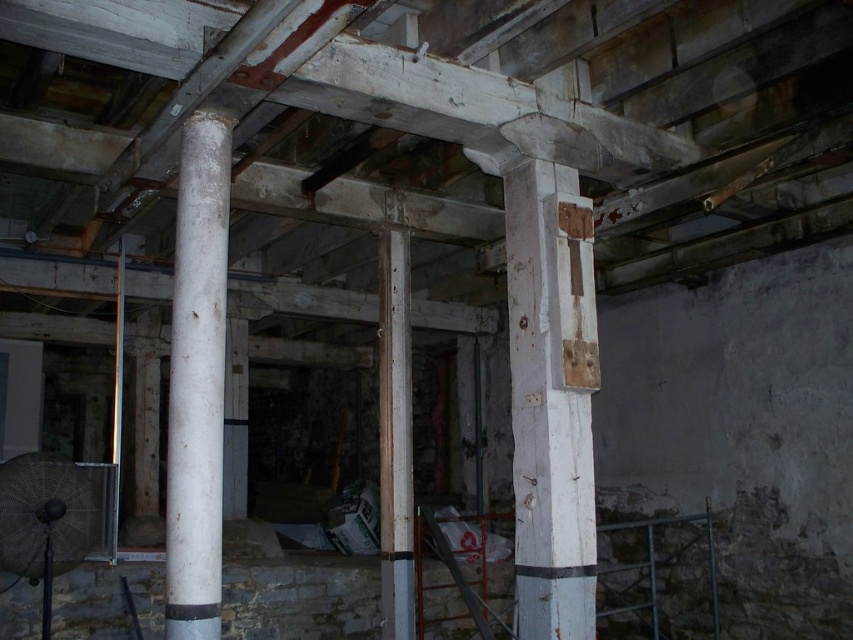
You are standing in the unfinished building and want to move from the entrance to the back wall. There are two points marked in the image, point 1 at coordinates (585, 508) and point 2 at coordinates (200, 316). Which point is closer to the entrance?

Point 2 at coordinates (200, 316) is closer to the entrance because it is in front of point 1 at coordinates (585, 508).

You are an architect inspecting the building. You notice the white matte column at center and the rusty metal pole at center. Which object would block your view of the other if you were standing directly in front of them?

The white matte column at center is in front of the rusty metal pole at center, so the white matte column at center would block your view of the rusty metal pole at center.

You are an architect inspecting the building. You notice the white matte column at center and the rusty metal pole at center. Which one is shorter in height?

The white matte column at center is shorter in height compared to the rusty metal pole at center.